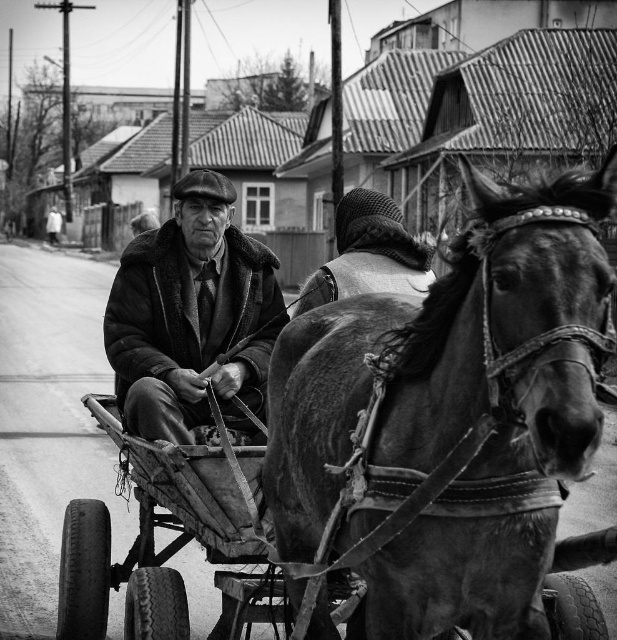
Between shiny dark brown horse at center and fur-lined coat at center, which one has less height?

Standing shorter between the two is fur-lined coat at center.

Can you confirm if shiny dark brown horse at center is positioned below fur-lined coat at center?

Correct, shiny dark brown horse at center is located below fur-lined coat at center.

What do you see at coordinates (450, 358) in the screenshot? I see `shiny dark brown horse at center` at bounding box center [450, 358].

Image resolution: width=617 pixels, height=640 pixels. In order to click on shiny dark brown horse at center in this screenshot , I will do `click(450, 358)`.

Between shiny dark brown horse at center and wooden cart at center, which one appears on the left side from the viewer's perspective?

Positioned to the left is wooden cart at center.

Does point (346, 419) come in front of point (226, 465)?

Yes, point (346, 419) is in front of point (226, 465).

In order to click on shiny dark brown horse at center in this screenshot , I will do `click(450, 358)`.

Between wooden cart at center and fur-lined coat at center, which one has less height?

wooden cart at center

Between wooden cart at center and fur-lined coat at center, which one appears on the right side from the viewer's perspective?

Positioned to the right is fur-lined coat at center.

Measure the distance between wooden cart at center and camera.

wooden cart at center and camera are 18.63 feet apart from each other.

The width and height of the screenshot is (617, 640). Identify the location of wooden cart at center. (147, 536).